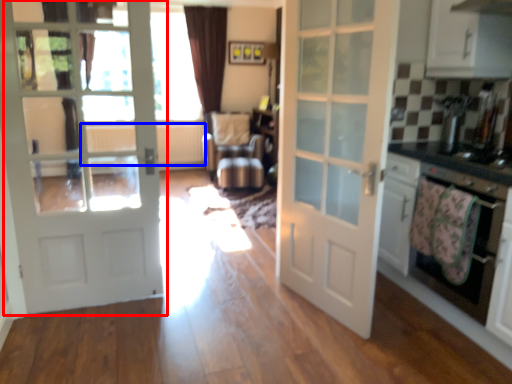
Question: Which object is closer to the camera taking this photo, door (highlighted by a red box) or radiator (highlighted by a blue box)?

Choices:
 (A) door
 (B) radiator

Answer: (A)